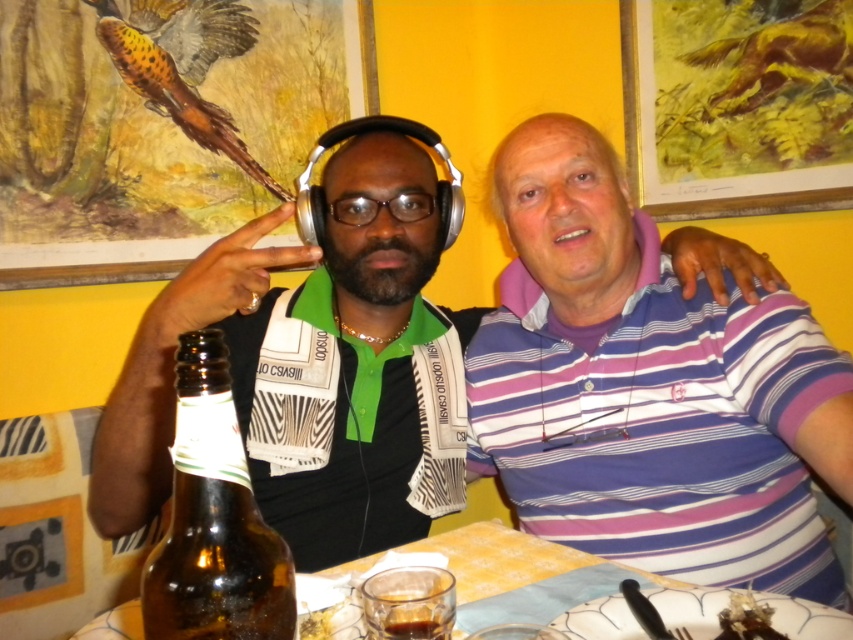
Question: Which point is farther to the camera?

Choices:
 (A) translucent glass at lower center
 (B) purple striped polo shirt at right
 (C) brown glass bottle at lower left
 (D) matte black headphones at left

Answer: (B)

Question: Can you confirm if purple striped polo shirt at right is wider than shiny chocolate bar at lower right?

Choices:
 (A) no
 (B) yes

Answer: (B)

Question: Which is nearer to the translucent glass at lower center?

Choices:
 (A) translucent glass cup at table center
 (B) translucent glass table at lower center

Answer: (A)

Question: Where is translucent glass cup at table center located in relation to shiny chocolate bar at lower right in the image?

Choices:
 (A) above
 (B) below

Answer: (A)

Question: Which point is closer to the camera?

Choices:
 (A) pos(322,612)
 (B) pos(480,531)

Answer: (A)

Question: Does brown glass bottle at lower left come in front of translucent glass at lower center?

Choices:
 (A) yes
 (B) no

Answer: (A)